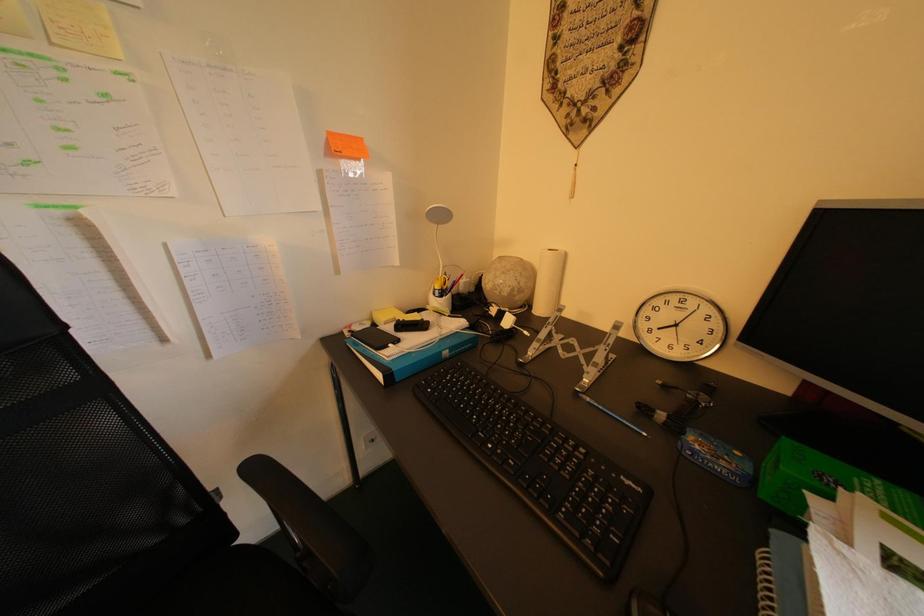
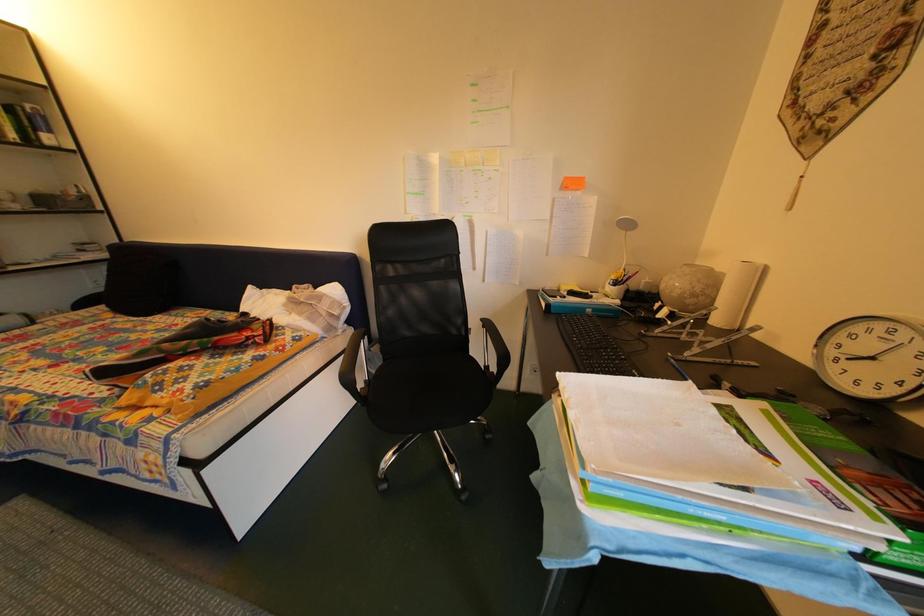
Question: The images are taken continuously from a first-person perspective. In which direction is your viewpoint rotating?

Choices:
 (A) Left
 (B) Right
 (C) Up
 (D) Down

Answer: (A)